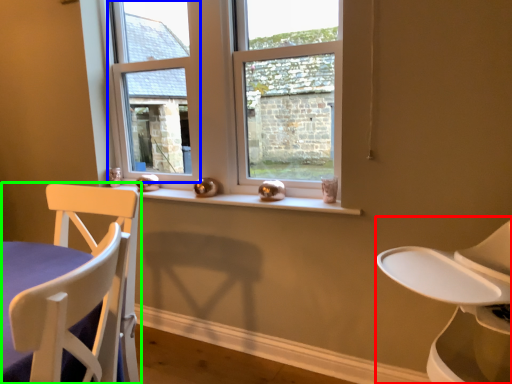
Question: Which object is the farthest from feeding chair (highlighted by a red box)? Choose among these: window frame (highlighted by a blue box) or chair (highlighted by a green box).

Choices:
 (A) window frame
 (B) chair

Answer: (A)